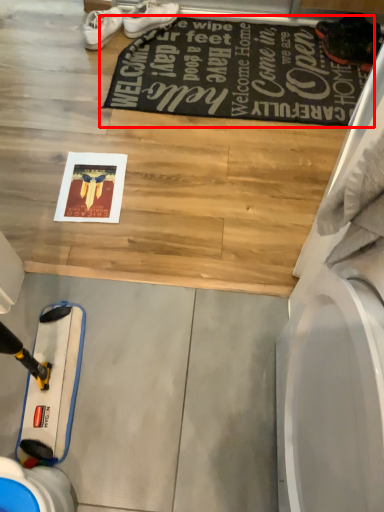
Question: From the image's perspective, what is the correct spatial positioning of mat (annotated by the red box) in reference to footwear?

Choices:
 (A) below
 (B) above

Answer: (A)